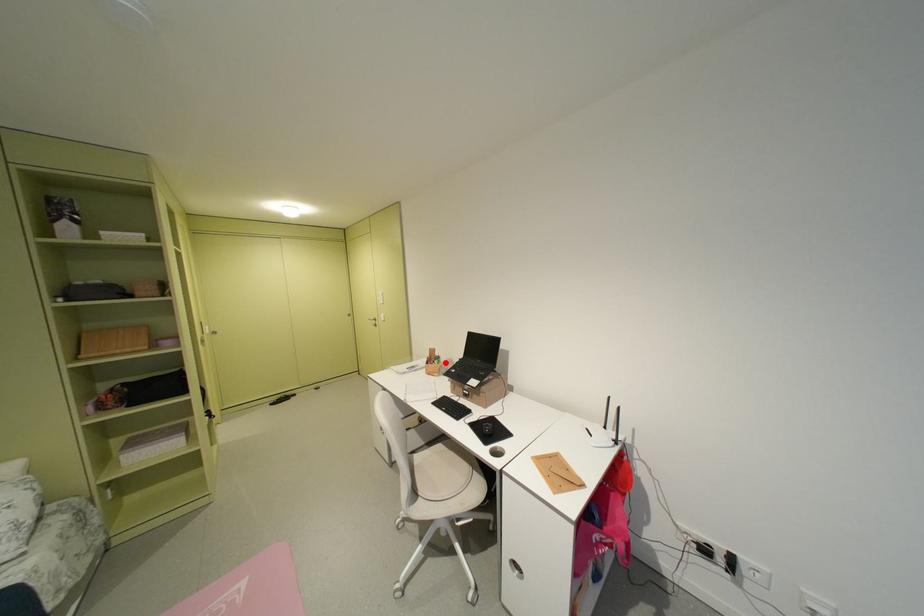
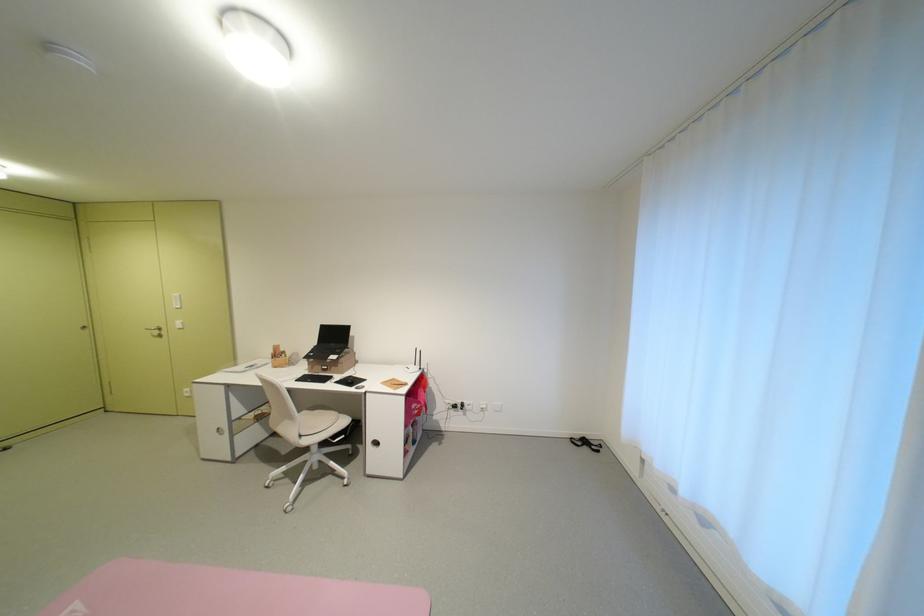
Where in the second image is the point corresponding to the highlighted location from the first image?

(293, 357)